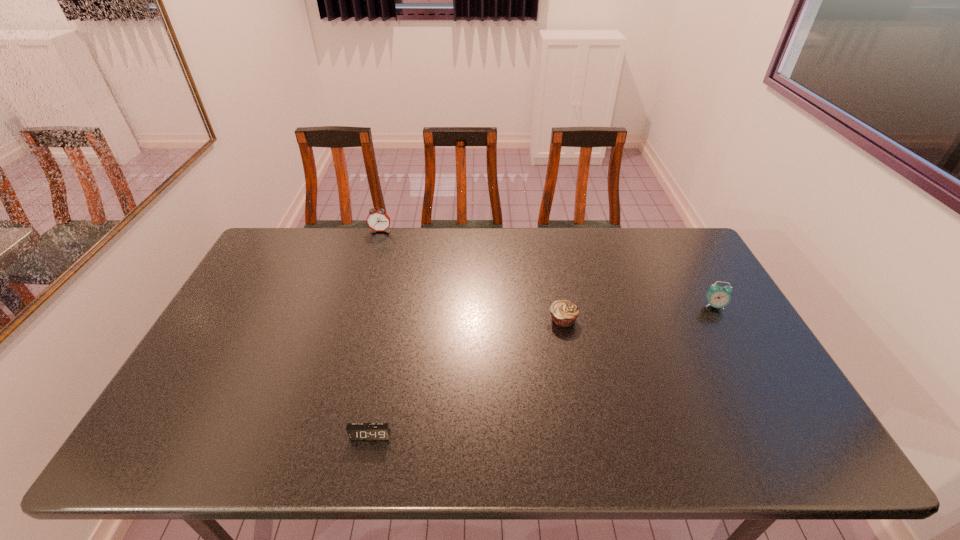
Find the location of a particular element. This screenshot has width=960, height=540. blank space located 0.200m on the right of the second object from right to left is located at coordinates (645, 320).

Locate an element on the screen. This screenshot has width=960, height=540. object positioned at the far edge is located at coordinates (377, 220).

The width and height of the screenshot is (960, 540). In order to click on object located in the near edge section of the desktop in this screenshot , I will do click(x=356, y=431).

In order to click on object that is at the right edge in this screenshot , I will do `click(718, 297)`.

I want to click on vacant region at the far edge of the desktop, so click(427, 239).

The width and height of the screenshot is (960, 540). Identify the location of free spot at the near edge of the desktop. (694, 448).

Where is `vacant space at the left edge of the desktop`? The height and width of the screenshot is (540, 960). vacant space at the left edge of the desktop is located at coordinates (160, 418).

In the image, there is a desktop. In order to click on vacant space at the right edge in this screenshot , I will do `click(723, 356)`.

This screenshot has width=960, height=540. I want to click on free space at the far left corner of the desktop, so click(x=260, y=254).

In the image, there is a desktop. At what (x,y) coordinates should I click in order to perform the action: click on vacant region at the far right corner. Please return your answer as a coordinate pair (x, y). This screenshot has width=960, height=540. Looking at the image, I should click on (650, 232).